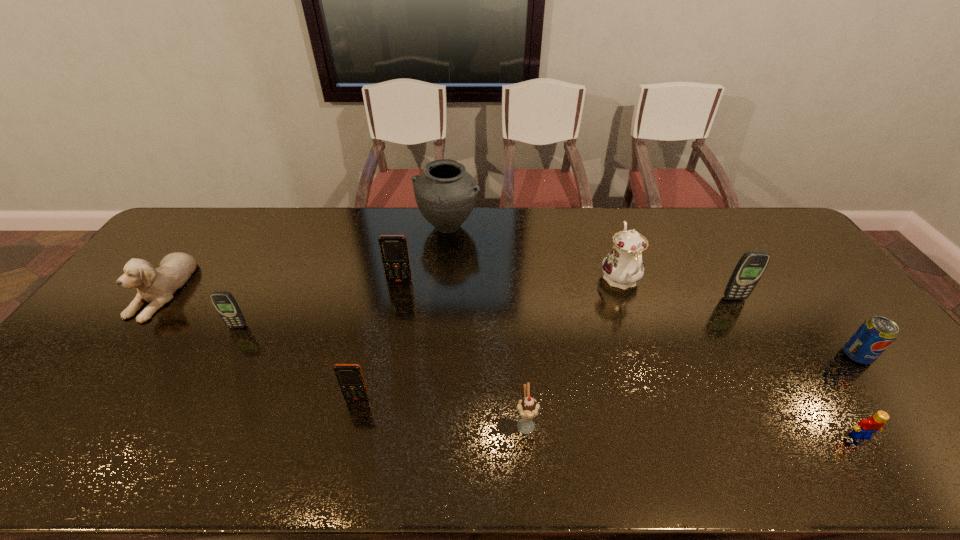
Identify the location of vacant region located on the screen of the right gray cellular telephone. (752, 328).

Locate an element on the screen. vacant position located on the screen of the farther orange cellular telephone is located at coordinates (382, 372).

At what (x,y) coordinates should I click in order to perform the action: click on free space located 0.330m on the front-facing side of the white puppy. Please return your answer as a coordinate pair (x, y). Looking at the image, I should click on (54, 433).

Where is `vacant space located on the screen of the eighth farthest object`? vacant space located on the screen of the eighth farthest object is located at coordinates (344, 457).

You are a GUI agent. You are given a task and a screenshot of the screen. Output one action in this format:
    pyautogui.click(x=<x>, y=<y>)
    Task: Click on the free space located 0.190m on the screen of the third farthest cellular telephone
    This screenshot has height=540, width=960.
    Given the screenshot: What is the action you would take?
    pyautogui.click(x=206, y=386)

Identify the location of blank space located on the back of the sixth object from left to right. This screenshot has height=540, width=960. (516, 314).

Locate an element on the screen. vacant space situated 0.290m on the left of the soda is located at coordinates (734, 355).

The image size is (960, 540). Identify the location of free space located 0.070m on the front-facing side of the shortest object. (883, 471).

Where is `object located at the far edge`? The width and height of the screenshot is (960, 540). object located at the far edge is located at coordinates (445, 193).

This screenshot has height=540, width=960. In order to click on icecream that is at the near edge in this screenshot , I will do `click(528, 408)`.